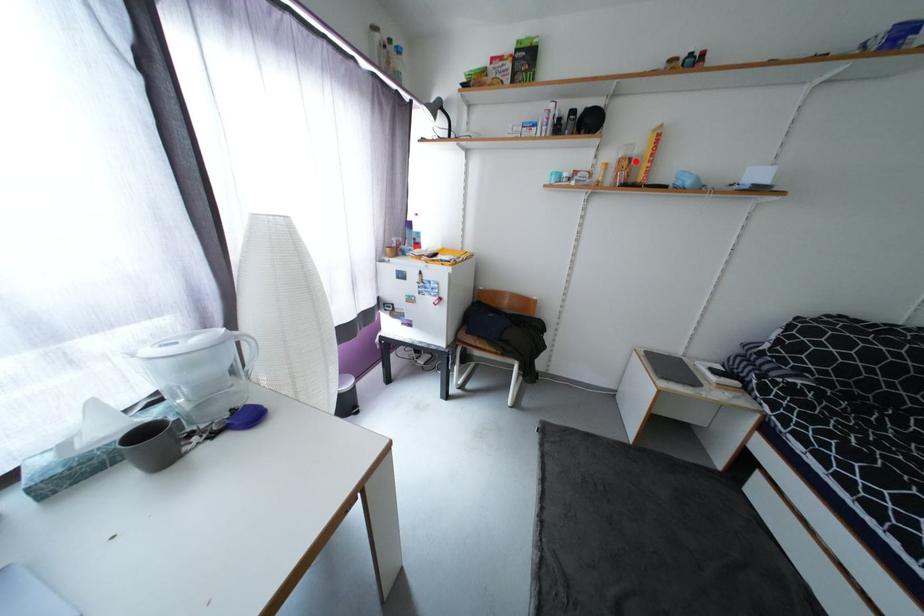
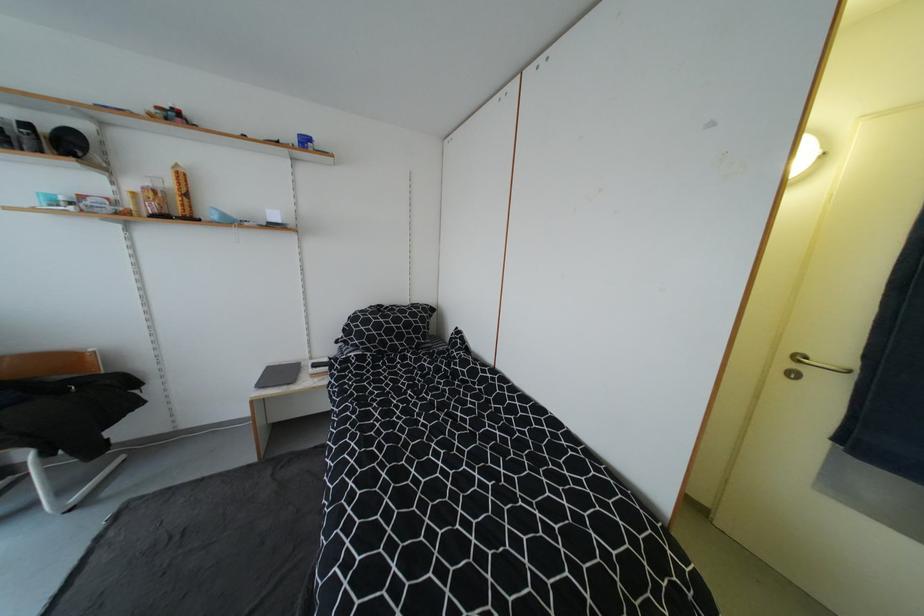
In the second image, find the point that corresponds to the highlighted location in the first image.

(161, 193)